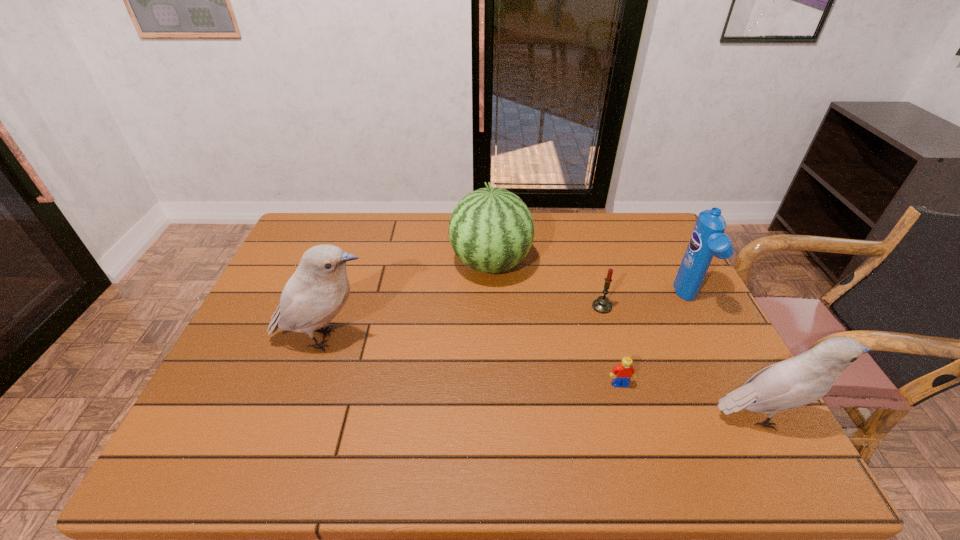
Where is `free space at the far edge of the desktop`? This screenshot has width=960, height=540. free space at the far edge of the desktop is located at coordinates (606, 237).

In the image, there is a desktop. Where is `vacant space at the near edge`? vacant space at the near edge is located at coordinates (518, 420).

At what (x,y) coordinates should I click in order to perform the action: click on vacant region at the left edge of the desktop. Please return your answer as a coordinate pair (x, y). This screenshot has height=540, width=960. Looking at the image, I should click on (286, 369).

Where is `vacant area at the right edge`? The height and width of the screenshot is (540, 960). vacant area at the right edge is located at coordinates (634, 260).

In the image, there is a desktop. At what (x,y) coordinates should I click in order to perform the action: click on free region at the far left corner. Please return your answer as a coordinate pair (x, y). Looking at the image, I should click on click(343, 213).

Where is `vacant space at the far right corner`? This screenshot has height=540, width=960. vacant space at the far right corner is located at coordinates (629, 212).

You are a GUI agent. You are given a task and a screenshot of the screen. Output one action in this format:
    pyautogui.click(x=<x>, y=<y>)
    Task: Click on the free point between the leftmost object and the shorter bird
    The image size is (960, 540).
    Given the screenshot: What is the action you would take?
    pyautogui.click(x=544, y=378)

At what (x,y) coordinates should I click in order to perform the action: click on free spot between the third nearest object and the second shortest object. Please return your answer as a coordinate pair (x, y). The width and height of the screenshot is (960, 540). Looking at the image, I should click on (464, 323).

At what (x,y) coordinates should I click in order to perform the action: click on vacant space in between the shampoo and the fifth farthest object. Please return your answer as a coordinate pair (x, y). Looking at the image, I should click on pos(654,341).

Locate an element on the screen. free space between the second object from left to right and the second shortest object is located at coordinates (546, 285).